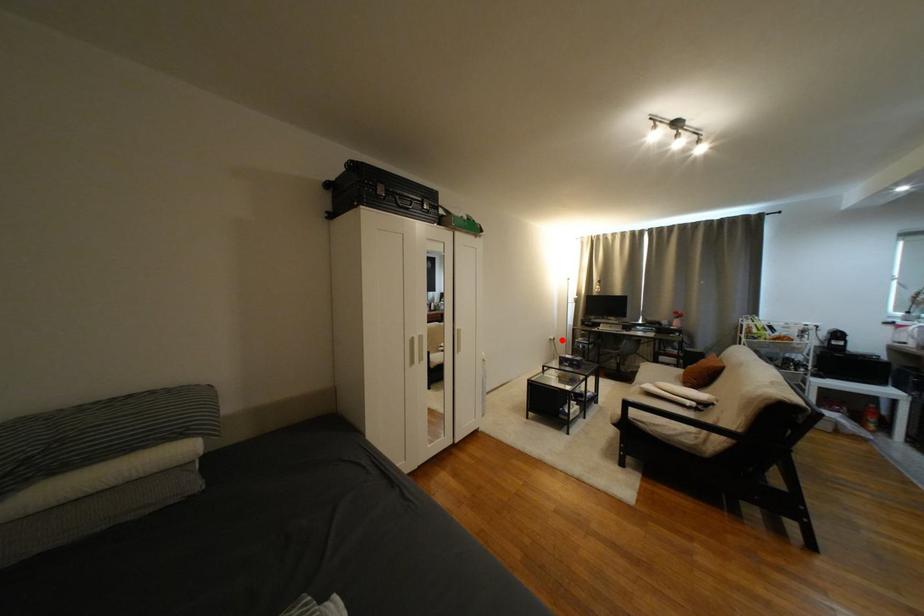
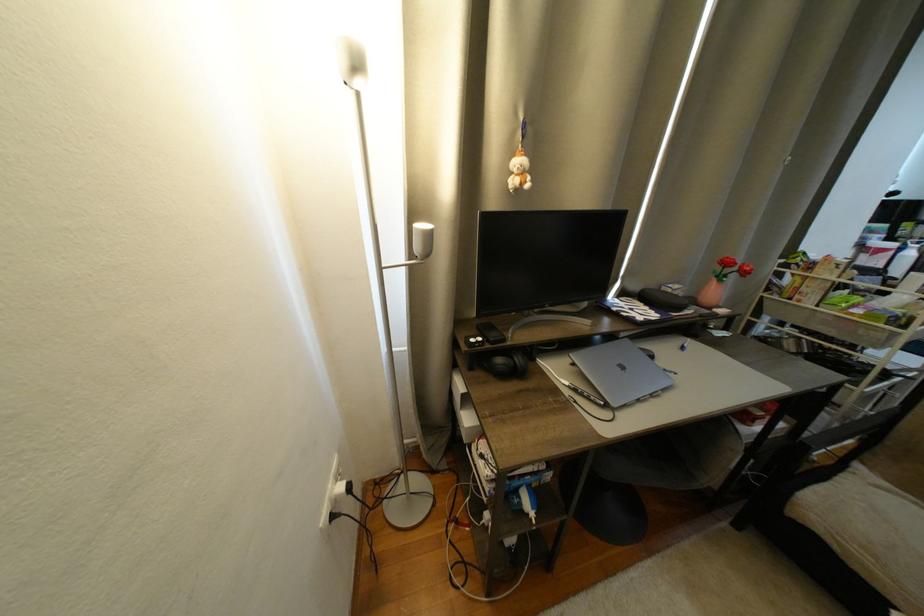
Question: I am providing you with two images of the same scene from different viewpoints. A red point is shown in image1. For the corresponding object point in image2, is it positioned nearer or farther from the camera?

Choices:
 (A) Nearer
 (B) Farther

Answer: (A)